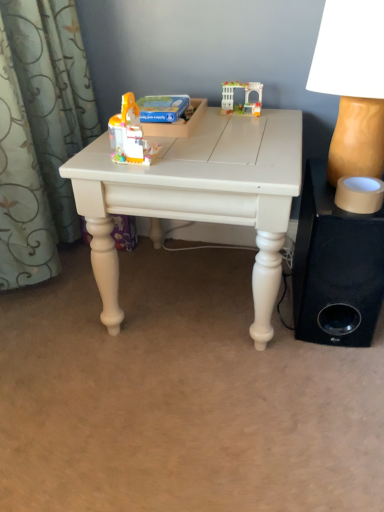
Describe the element at coordinates (335, 267) in the screenshot. I see `black fabric speaker at lower right` at that location.

What is the approximate height of white matte table at center?

It is 19.75 inches.

You are a GUI agent. You are given a task and a screenshot of the screen. Output one action in this format:
    pyautogui.click(x=<x>, y=<y>)
    Task: Click on the matte beige lampshade at right
    
    Given the screenshot: What is the action you would take?
    pyautogui.click(x=352, y=84)

The width and height of the screenshot is (384, 512). I want to click on black fabric speaker at lower right, so click(x=335, y=267).

Where is `table below the white plastic toy at upper center, acting as the 1th toy starting from the right (from a real-world perspective)`? table below the white plastic toy at upper center, acting as the 1th toy starting from the right (from a real-world perspective) is located at coordinates (198, 196).

Can you confirm if white plastic toy at upper center, which is the 2th toy from front to back, is bigger than white matte table at center?

No.

Does white plastic toy at upper center, arranged as the 1th toy when viewed from the back, turn towards white matte table at center?

No.

Is translucent plastic toy at center, the 2th toy when ordered from right to left, placed right next to black fabric speaker at lower right?

No, translucent plastic toy at center, the 2th toy when ordered from right to left, is not in contact with black fabric speaker at lower right.

Can you confirm if translucent plastic toy at center, which is counted as the 2th toy, starting from the top, is bigger than black fabric speaker at lower right?

No, translucent plastic toy at center, which is counted as the 2th toy, starting from the top, is not bigger than black fabric speaker at lower right.

Considering the positions of objects translucent plastic toy at center, the 2th toy when ordered from right to left, and black fabric speaker at lower right in the image provided, who is more to the right, translucent plastic toy at center, the 2th toy when ordered from right to left, or black fabric speaker at lower right?

From the viewer's perspective, black fabric speaker at lower right appears more on the right side.

From the image's perspective, is black fabric speaker at lower right under white plastic toy at upper center, acting as the 1th toy starting from the right?

Correct, black fabric speaker at lower right appears lower than white plastic toy at upper center, acting as the 1th toy starting from the right, in the image.

Who is taller, black fabric speaker at lower right or white plastic toy at upper center, arranged as the first toy when viewed from the top?

Standing taller between the two is black fabric speaker at lower right.

Is black fabric speaker at lower right at the left side of white plastic toy at upper center, placed as the 2th toy when sorted from left to right?

No.

From the picture: Measure the distance from black fabric speaker at lower right to white plastic toy at upper center, which is the 2th toy from front to back.

The distance of black fabric speaker at lower right from white plastic toy at upper center, which is the 2th toy from front to back, is 21.08 inches.

Is black fabric speaker at lower right not near matte beige lampshade at right?

black fabric speaker at lower right is near matte beige lampshade at right, not far away.

From a real-world perspective, relative to matte beige lampshade at right, is black fabric speaker at lower right vertically above or below?

From a real-world perspective, black fabric speaker at lower right is physically below matte beige lampshade at right.

Is black fabric speaker at lower right taller or shorter than matte beige lampshade at right?

Clearly, black fabric speaker at lower right is taller compared to matte beige lampshade at right.

This screenshot has width=384, height=512. I want to click on table lamp on the left of black fabric speaker at lower right, so click(x=352, y=84).

From a real-world perspective, who is located lower, white matte table at center or translucent plastic toy at center, the 2th toy when ordered from right to left?

white matte table at center.

Find the location of a particular element. The height and width of the screenshot is (512, 384). the 2nd toy above the white matte table at center (from a real-world perspective) is located at coordinates (130, 134).

Is translucent plastic toy at center, the 1th toy in the bottom-to-top sequence, at the back of white matte table at center?

white matte table at center is not turned away from translucent plastic toy at center, the 1th toy in the bottom-to-top sequence.

How different are the orientations of white matte table at center and translucent plastic toy at center, positioned as the 1th toy in front-to-back order, in degrees?

3.74 degrees separate the facing orientations of white matte table at center and translucent plastic toy at center, positioned as the 1th toy in front-to-back order.

From the image's perspective, which one is positioned higher, matte beige lampshade at right or white plastic toy at upper center, placed as the 2th toy when sorted from left to right?

white plastic toy at upper center, placed as the 2th toy when sorted from left to right, appears higher in the image.

From a real-world perspective, is matte beige lampshade at right located higher than white plastic toy at upper center, arranged as the first toy when viewed from the top?

Indeed, from a real-world perspective, matte beige lampshade at right stands above white plastic toy at upper center, arranged as the first toy when viewed from the top.

Can you confirm if matte beige lampshade at right is thinner than white plastic toy at upper center, which is the 2th toy from front to back?

In fact, matte beige lampshade at right might be wider than white plastic toy at upper center, which is the 2th toy from front to back.

Is white plastic toy at upper center, arranged as the first toy when viewed from the top, situated inside black fabric speaker at lower right or outside?

white plastic toy at upper center, arranged as the first toy when viewed from the top, exists outside the volume of black fabric speaker at lower right.

Which is in front, point (256, 106) or point (308, 182)?

The point (256, 106) is closer to the camera.

Consider the image. Which object is further away from the camera, white plastic toy at upper center, arranged as the 1th toy when viewed from the back, or black fabric speaker at lower right?

white plastic toy at upper center, arranged as the 1th toy when viewed from the back, is further from the camera.

Where is `the 2nd toy behind when counting from the white matte table at center`? the 2nd toy behind when counting from the white matte table at center is located at coordinates (245, 97).

At what (x,y) coordinates should I click in order to perform the action: click on speaker that is under the translucent plastic toy at center, which is the 2th toy in back-to-front order (from a real-world perspective). Please return your answer as a coordinate pair (x, y). The width and height of the screenshot is (384, 512). Looking at the image, I should click on (335, 267).

Based on their spatial positions, is black fabric speaker at lower right or translucent plastic toy at center, which is counted as the 2th toy, starting from the top, further from white matte table at center?

black fabric speaker at lower right.

Estimate the real-world distances between objects in this image. Which object is further from translucent plastic toy at center, which is counted as the 2th toy, starting from the top, white matte table at center or black fabric speaker at lower right?

black fabric speaker at lower right lies further to translucent plastic toy at center, which is counted as the 2th toy, starting from the top, than the other object.

Which object lies further to the anchor point white matte table at center, white plastic toy at upper center, acting as the 1th toy starting from the right, or black fabric speaker at lower right?

Based on the image, white plastic toy at upper center, acting as the 1th toy starting from the right, appears to be further to white matte table at center.

Estimate the real-world distances between objects in this image. Which object is closer to black fabric speaker at lower right, translucent plastic toy at center, the 1th toy in the bottom-to-top sequence, or white matte table at center?

white matte table at center is closer to black fabric speaker at lower right.

Consider the image. From the image, which object appears to be farther from white matte table at center, translucent plastic toy at center, positioned as the 1th toy in front-to-back order, or black fabric speaker at lower right?

The object further to white matte table at center is black fabric speaker at lower right.

Looking at the image, which one is located closer to white plastic toy at upper center, acting as the 1th toy starting from the right, translucent plastic toy at center, the 1th toy in the bottom-to-top sequence, or matte beige lampshade at right?

matte beige lampshade at right is closer to white plastic toy at upper center, acting as the 1th toy starting from the right.

In the scene shown: Based on their spatial positions, is black fabric speaker at lower right or matte beige lampshade at right further from translucent plastic toy at center, the 1th toy in the bottom-to-top sequence?

black fabric speaker at lower right is positioned further to the anchor translucent plastic toy at center, the 1th toy in the bottom-to-top sequence.

When comparing their distances from white matte table at center, does matte beige lampshade at right or black fabric speaker at lower right seem further?

matte beige lampshade at right is further to white matte table at center.

Identify the location of toy between translucent plastic toy at center, which is counted as the 2th toy, starting from the top, and matte beige lampshade at right from left to right. This screenshot has height=512, width=384. (245, 97).

This screenshot has height=512, width=384. In order to click on table lamp between white plastic toy at upper center, arranged as the first toy when viewed from the top, and black fabric speaker at lower right vertically in this screenshot , I will do `click(352, 84)`.

Locate an element on the screen. The image size is (384, 512). table positioned between matte beige lampshade at right and white plastic toy at upper center, arranged as the first toy when viewed from the top, from near to far is located at coordinates (198, 196).

Where is `table lamp between translucent plastic toy at center, the 1th toy in the bottom-to-top sequence, and black fabric speaker at lower right, in the horizontal direction`? table lamp between translucent plastic toy at center, the 1th toy in the bottom-to-top sequence, and black fabric speaker at lower right, in the horizontal direction is located at coordinates (352, 84).